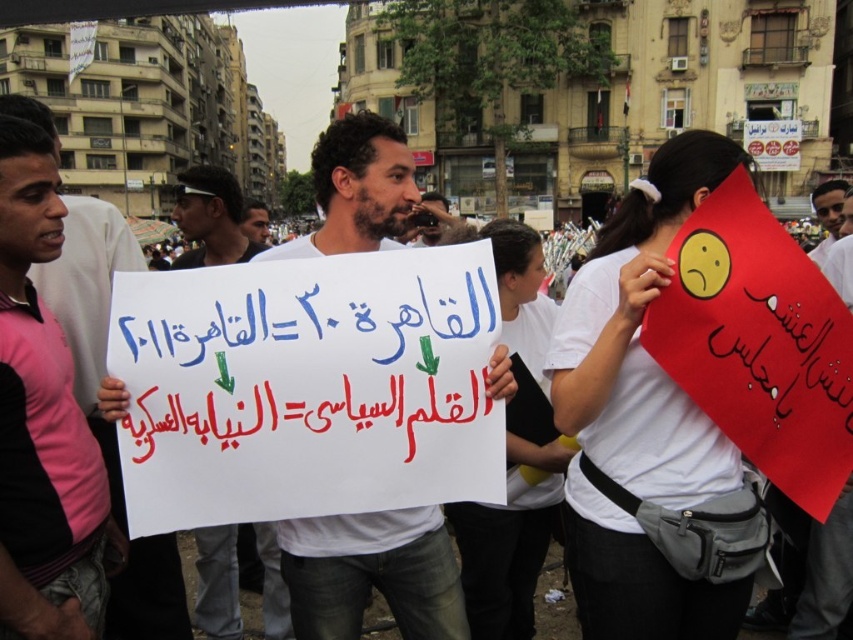
Question: Which object is farther from the camera taking this photo?

Choices:
 (A) white paper sign at center
 (B) red paper sign at upper right
 (C) smooth skin face at upper right

Answer: (C)

Question: Can you confirm if white paper sign at center is thinner than smooth skin face at upper right?

Choices:
 (A) yes
 (B) no

Answer: (A)

Question: Does white paper sign at center appear under matte white shirt at center?

Choices:
 (A) yes
 (B) no

Answer: (B)

Question: Which object is the farthest from the matte white shirt at center?

Choices:
 (A) matte red sign at right
 (B) white paper sign at center

Answer: (A)

Question: Is pink jersey at center positioned in front of red paper sign at center?

Choices:
 (A) no
 (B) yes

Answer: (B)

Question: Which of these objects is positioned farthest from the pink jersey at center?

Choices:
 (A) smooth skin face at upper right
 (B) matte white shirt at center
 (C) white paper sign at center
 (D) matte red sign at right

Answer: (A)